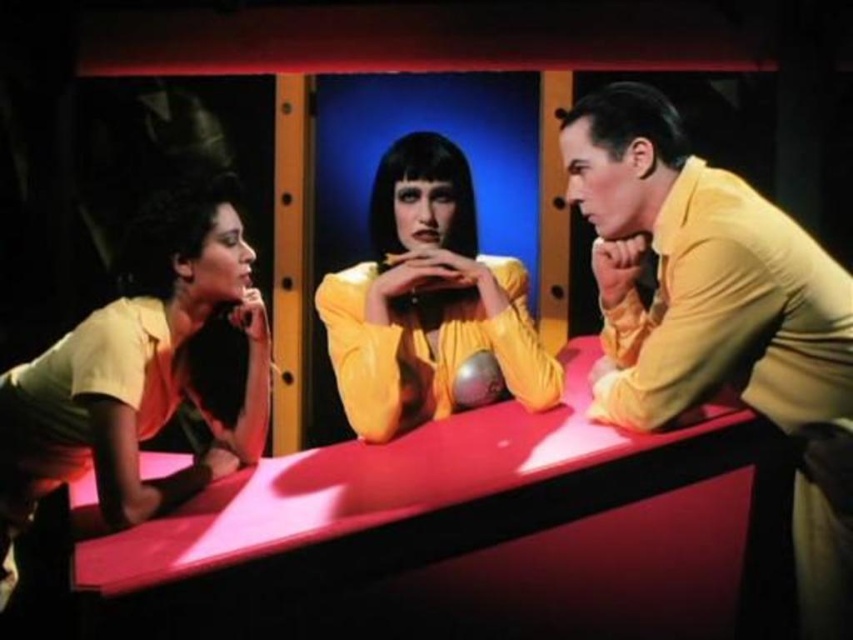
Question: Can you confirm if glossy plastic table at center is bigger than yellow smooth shirt at right?

Choices:
 (A) yes
 (B) no

Answer: (A)

Question: Which point appears farthest from the camera in this image?

Choices:
 (A) (653, 241)
 (B) (386, 320)
 (C) (380, 456)
 (D) (102, 502)

Answer: (B)

Question: Does yellow smooth shirt at right have a smaller size compared to matte yellow blouse at left?

Choices:
 (A) yes
 (B) no

Answer: (B)

Question: Is glossy plastic table at center below yellow smooth shirt at right?

Choices:
 (A) yes
 (B) no

Answer: (A)

Question: Which object is the farthest from the yellow smooth shirt at right?

Choices:
 (A) matte yellow blouse at center
 (B) glossy plastic table at center
 (C) matte yellow blouse at left

Answer: (C)

Question: Which of the following is the closest to the observer?

Choices:
 (A) (100, 488)
 (B) (230, 486)
 (C) (567, 124)
 (D) (433, 276)

Answer: (A)